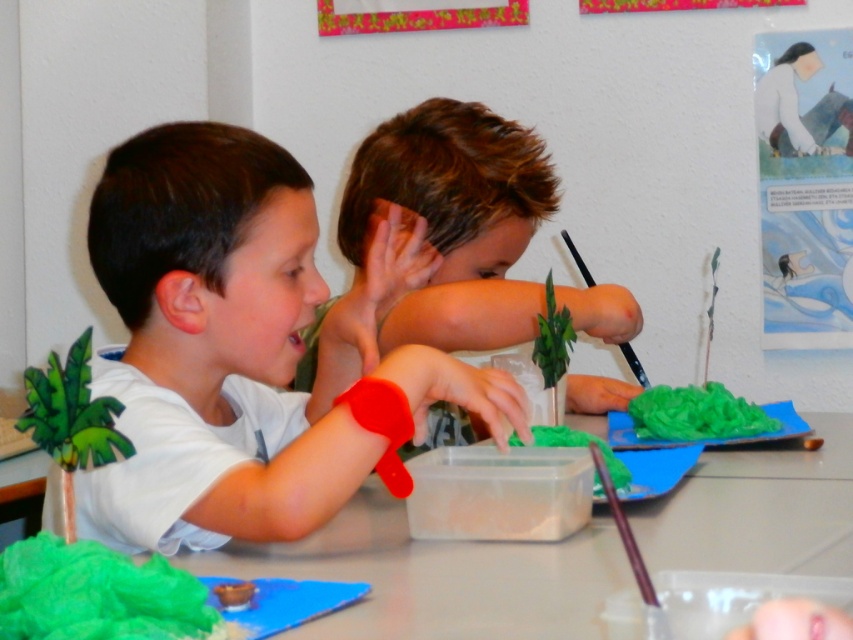
You are a photographer standing in front of the table where the two children are working. You need to capture a photo that includes both the white matte shirt at center and the brown hair boy at center. Based on their positions, which object should be placed on the left side of the photo frame?

The white matte shirt at center should be placed on the left side of the photo frame because it is positioned on the left side of the brown hair boy at center in the scene.

You are a teacher observing two children at a table. You notice the white matte shirt at center and the green paper at center. Which object is located to the left of the other?

The white matte shirt at center is positioned on the left side of green paper at center, so the white matte shirt at center is to the left of the green paper at center.